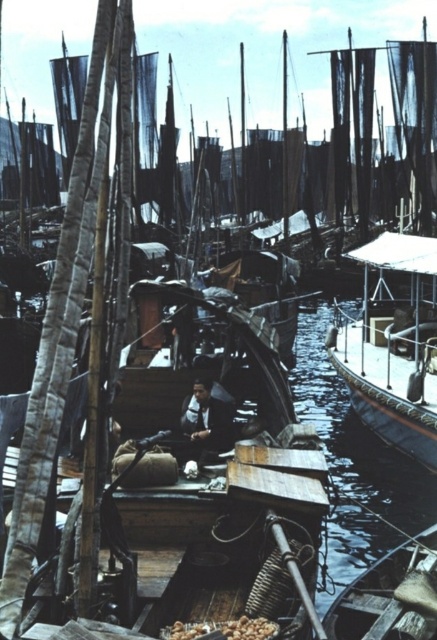
Measure the distance from wooden boat at right to wooden boat at lower right.

wooden boat at right is 10.24 meters away from wooden boat at lower right.

Which is in front, point (419, 452) or point (381, 573)?

Point (381, 573) is in front.

Between point (391, 253) and point (434, 541), which one is positioned behind?

Point (391, 253)

Where is `wooden boat at right`? The width and height of the screenshot is (437, 640). wooden boat at right is located at coordinates (394, 346).

Is wooden boat at lower right above dark blue fabric at center?

Actually, wooden boat at lower right is below dark blue fabric at center.

Is wooden boat at lower right further to the viewer compared to dark blue fabric at center?

No, it is not.

Based on the photo, measure the distance between wooden boat at lower right and camera.

The distance of wooden boat at lower right from camera is 9.58 meters.

The height and width of the screenshot is (640, 437). What are the coordinates of `wooden boat at lower right` in the screenshot? It's located at (391, 595).

Where is `wooden boat at right`? wooden boat at right is located at coordinates (394, 346).

Does point (392, 264) come closer to viewer compared to point (198, 436)?

That is False.

At what (x,y) coordinates should I click in order to perform the action: click on wooden boat at right. Please return your answer as a coordinate pair (x, y). This screenshot has width=437, height=640. Looking at the image, I should click on (394, 346).